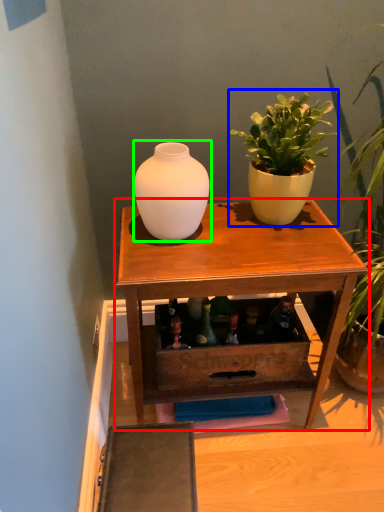
Question: Considering the real-world distances, which object is farthest from table (highlighted by a red box)? houseplant (highlighted by a blue box) or vase (highlighted by a green box)?

Choices:
 (A) houseplant
 (B) vase

Answer: (A)